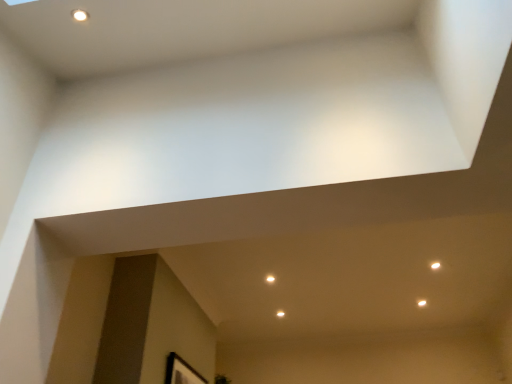
Question: Is white glossy light at center looking in the opposite direction of black matte picture frame at lower right?

Choices:
 (A) no
 (B) yes

Answer: (A)

Question: From the image's perspective, is white glossy light at center below black matte picture frame at lower right?

Choices:
 (A) no
 (B) yes

Answer: (A)

Question: Is white glossy light at center aimed at black matte picture frame at lower right?

Choices:
 (A) yes
 (B) no

Answer: (B)

Question: Does white glossy light at center have a lesser width compared to black matte picture frame at lower right?

Choices:
 (A) no
 (B) yes

Answer: (A)

Question: Is white glossy light at center in contact with black matte picture frame at lower right?

Choices:
 (A) no
 (B) yes

Answer: (A)

Question: From a real-world perspective, is white glossy light at center physically above black matte picture frame at lower right?

Choices:
 (A) yes
 (B) no

Answer: (A)

Question: From the image's perspective, is black matte picture frame at lower right below white glossy light at center?

Choices:
 (A) no
 (B) yes

Answer: (B)

Question: Is black matte picture frame at lower right aimed at white glossy light at center?

Choices:
 (A) no
 (B) yes

Answer: (A)

Question: Is black matte picture frame at lower right positioned far away from white glossy light at center?

Choices:
 (A) yes
 (B) no

Answer: (A)

Question: Can you confirm if black matte picture frame at lower right is wider than white glossy light at center?

Choices:
 (A) yes
 (B) no

Answer: (B)

Question: Does black matte picture frame at lower right have a lesser width compared to white glossy light at center?

Choices:
 (A) yes
 (B) no

Answer: (A)

Question: Would you say black matte picture frame at lower right contains white glossy light at center?

Choices:
 (A) no
 (B) yes

Answer: (A)

Question: From a real-world perspective, relative to black matte picture frame at lower right, is white glossy light at center vertically above or below?

Choices:
 (A) below
 (B) above

Answer: (B)